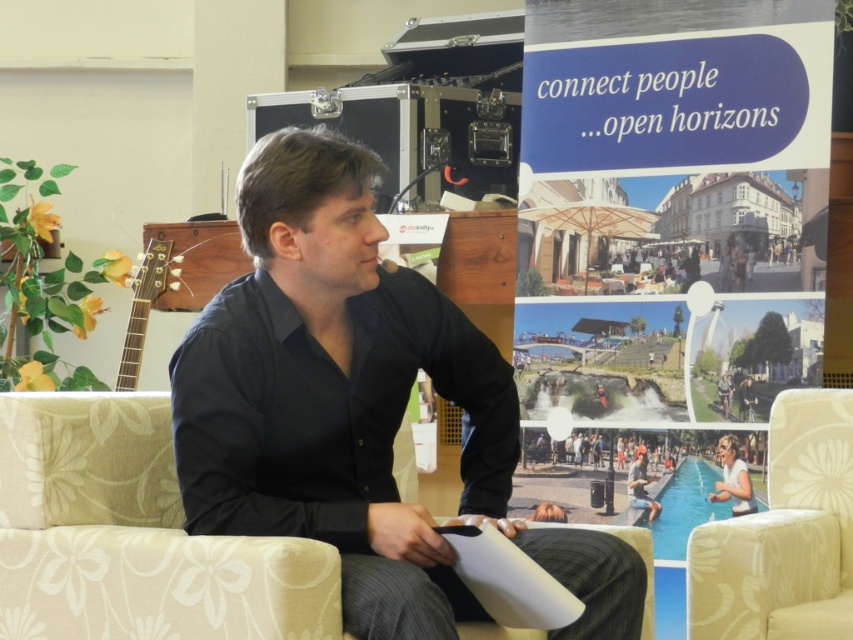
Consider the image. Based on the scene description, where is the black matte shirt at center located in terms of its 2D coordinates?

The black matte shirt at center is located at the 2D coordinates of point (357, 404).

You are standing in the lounge area and see two points marked in the image. Which point is nearer to you, point (149, 564) or point (466, 614)?

Point (149, 564) is closer to the viewer than point (466, 614).